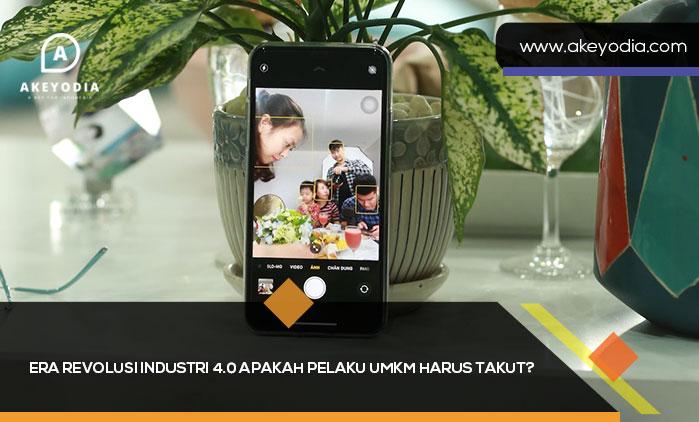
This screenshot has width=699, height=422. I want to click on plant, so click(x=127, y=42), click(x=86, y=12), click(x=331, y=28), click(x=446, y=113), click(x=488, y=93).